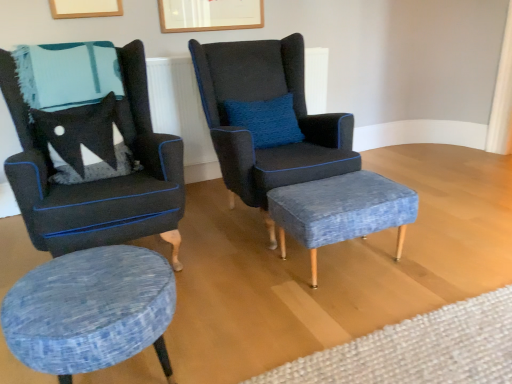
The height and width of the screenshot is (384, 512). In order to click on vacant space to the right of textured blue fabric stool at lower left, placed as the 1th stool when sorted from front to back in this screenshot , I will do `click(236, 341)`.